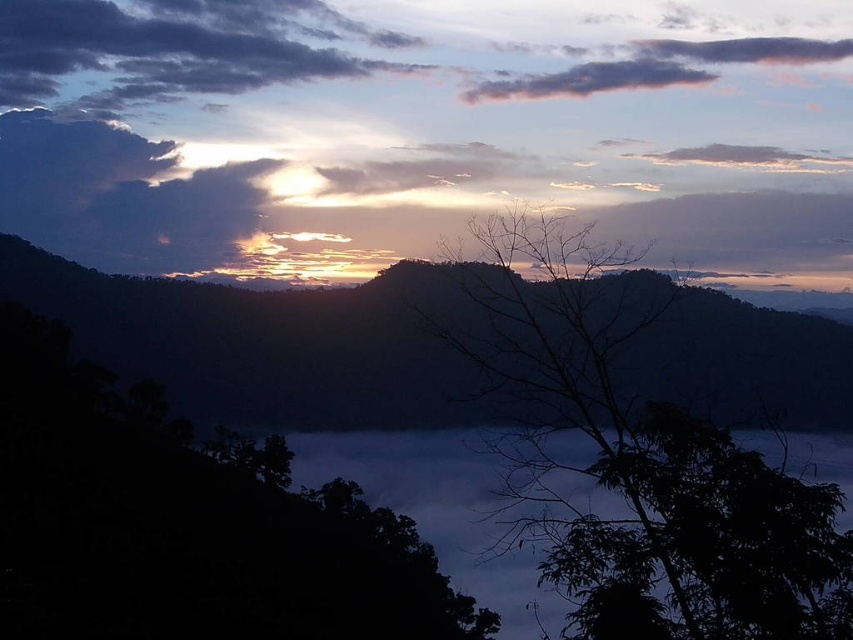
You are an astronomer observing the sky and the landscape. You notice the silhouetted mountain at center and the dark gray cloud at upper center. Which object is positioned higher in the sky?

The dark gray cloud at upper center is positioned higher in the sky than the silhouetted mountain at center.

You are an astronomer analyzing the image. You need to locate the silhouetted mountain at center. What are its coordinates?

The silhouetted mountain at center is located at coordinates point (271,342).